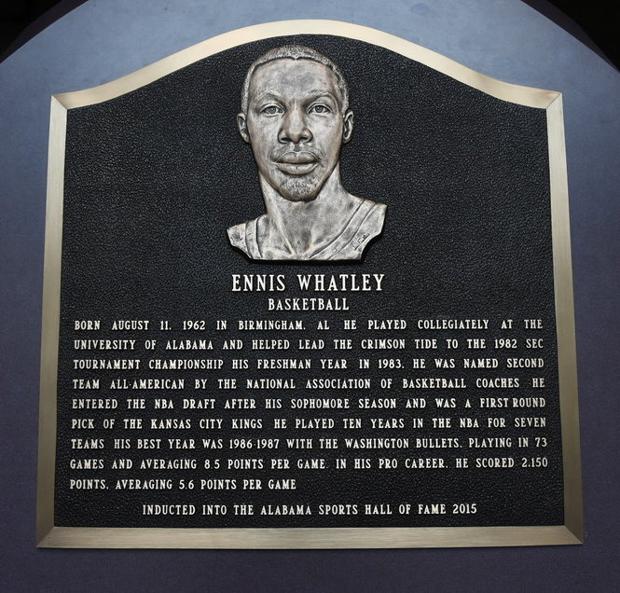
This screenshot has width=620, height=593. Identify the location of frame. (291, 27), (43, 486), (237, 535), (562, 382).